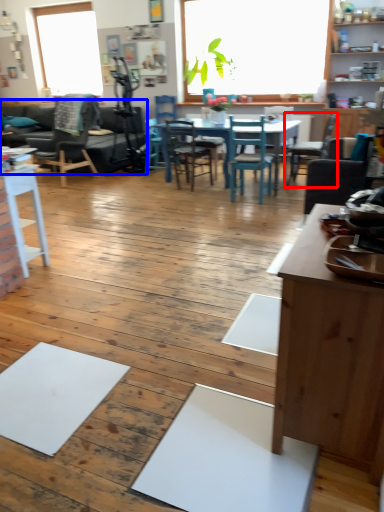
Question: Among these objects, which one is nearest to the camera, chair (highlighted by a red box) or couch (highlighted by a blue box)?

Choices:
 (A) chair
 (B) couch

Answer: (A)